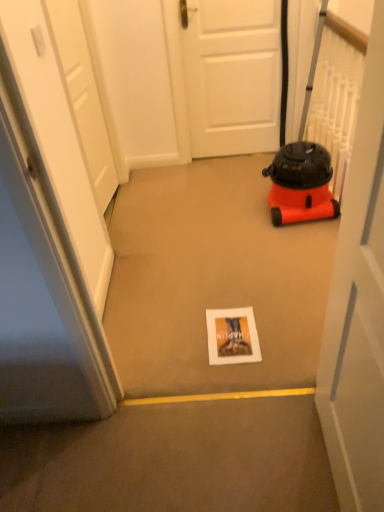
Measure the distance between point (210, 347) and camera.

The depth of point (210, 347) is 5.72 feet.

What do you see at coordinates (300, 156) in the screenshot? I see `orange matte vacuum cleaner at right` at bounding box center [300, 156].

What is the approximate width of white matte door at center, marked as the 3th door in a front-to-back arrangement?

It is 1.92 inches.

Measure the distance between white matte door at center, the third door viewed from the left, and camera.

white matte door at center, the third door viewed from the left, is 79.10 centimeters from camera.

Image resolution: width=384 pixels, height=512 pixels. What do you see at coordinates (358, 308) in the screenshot?
I see `white matte door at center, acting as the 1th door starting from the right` at bounding box center [358, 308].

Where is `matte paper postcard at center`? matte paper postcard at center is located at coordinates (232, 336).

Between point (312, 143) and point (240, 22), which one is positioned behind?

The point (312, 143) is farther from the camera.

Find the location of a particular element. The image size is (384, 512). door that appears above the orange matte vacuum cleaner at right (from the image's perspective) is located at coordinates (235, 74).

From a real-world perspective, relative to white matte door at center, the first door in the back-to-front sequence, is orange matte vacuum cleaner at right vertically above or below?

From a real-world perspective, orange matte vacuum cleaner at right is physically above white matte door at center, the first door in the back-to-front sequence.

From the picture: Measure the distance between white matte door at upper left, arranged as the 2th door when viewed from the front, and white matte door at center, marked as the 3th door in a front-to-back arrangement.

white matte door at upper left, arranged as the 2th door when viewed from the front, and white matte door at center, marked as the 3th door in a front-to-back arrangement, are 35.51 inches apart.

Is white matte door at upper left, the 1th door when ordered from left to right, to the right of white matte door at center, the second door from the right, from the viewer's perspective?

No, white matte door at upper left, the 1th door when ordered from left to right, is not to the right of white matte door at center, the second door from the right.

From a real-world perspective, who is located higher, white matte door at upper left, the third door positioned from the right, or white matte door at center, marked as the 3th door in a front-to-back arrangement?

In real-world perspective, white matte door at upper left, the third door positioned from the right, is above.

Could you tell me if white matte door at upper left, the 1th door when ordered from left to right, is turned towards white matte door at center, the second door from the right?

Yes, white matte door at upper left, the 1th door when ordered from left to right, is turned towards white matte door at center, the second door from the right.

Which is more to the left, white matte door at center, the first door viewed from the front, or matte paper postcard at center?

From the viewer's perspective, matte paper postcard at center appears more on the left side.

Which is farther, [379,502] or [223,339]?

Point [223,339]

From the image's perspective, is white matte door at center, the third door viewed from the left, on matte paper postcard at center?

Yes.

Considering the relative positions of white matte door at center, the third door viewed from the left, and matte paper postcard at center in the image provided, is white matte door at center, the third door viewed from the left, in front of matte paper postcard at center?

Yes, the depth of white matte door at center, the third door viewed from the left, is less than that of matte paper postcard at center.

Considering the positions of objects matte paper postcard at center and orange matte vacuum cleaner at right in the image provided, who is behind, matte paper postcard at center or orange matte vacuum cleaner at right?

Positioned behind is orange matte vacuum cleaner at right.

From the image's perspective, is matte paper postcard at center on top of orange matte vacuum cleaner at right?

Incorrect, from the image's perspective, matte paper postcard at center is lower than orange matte vacuum cleaner at right.

Which is further, [259,349] or [283,186]?

Positioned behind is point [283,186].

Visually, is matte paper postcard at center positioned to the left or to the right of orange matte vacuum cleaner at right?

In the image, matte paper postcard at center appears on the left side of orange matte vacuum cleaner at right.

Is the surface of orange matte vacuum cleaner at right in direct contact with matte paper postcard at center?

There is a gap between orange matte vacuum cleaner at right and matte paper postcard at center.

From a real-world perspective, is orange matte vacuum cleaner at right located higher than matte paper postcard at center?

Yes, from a real-world perspective, orange matte vacuum cleaner at right is above matte paper postcard at center.

From the image's perspective, is orange matte vacuum cleaner at right above or below matte paper postcard at center?

orange matte vacuum cleaner at right is situated higher than matte paper postcard at center in the image.

In the scene shown: Considering the sizes of orange matte vacuum cleaner at right and matte paper postcard at center in the image, is orange matte vacuum cleaner at right taller or shorter than matte paper postcard at center?

orange matte vacuum cleaner at right is taller than matte paper postcard at center.

Between white matte door at center, the second door from the right, and orange matte vacuum cleaner at right, which one has smaller size?

With smaller size is white matte door at center, the second door from the right.

Considering the sizes of objects white matte door at center, the second door from the right, and orange matte vacuum cleaner at right in the image provided, who is taller, white matte door at center, the second door from the right, or orange matte vacuum cleaner at right?

orange matte vacuum cleaner at right.

Is white matte door at center, marked as the 3th door in a front-to-back arrangement, surrounding orange matte vacuum cleaner at right?

That's incorrect, orange matte vacuum cleaner at right is not inside white matte door at center, marked as the 3th door in a front-to-back arrangement.

Looking at this image, from a real-world perspective, is white matte door at center, the first door in the back-to-front sequence, under orange matte vacuum cleaner at right?

Yes, from a real-world perspective, white matte door at center, the first door in the back-to-front sequence, is below orange matte vacuum cleaner at right.

Is white matte door at center, marked as the 3th door in a front-to-back arrangement, located within matte paper postcard at center?

No, white matte door at center, marked as the 3th door in a front-to-back arrangement, is not a part of matte paper postcard at center.

From the image's perspective, is matte paper postcard at center on white matte door at center, the first door in the back-to-front sequence?

No.

Is matte paper postcard at center taller than white matte door at center, the second door from the right?

No, matte paper postcard at center is not taller than white matte door at center, the second door from the right.

Could you tell me if matte paper postcard at center is facing white matte door at center, the second door from the right?

No, matte paper postcard at center is not facing towards white matte door at center, the second door from the right.

I want to click on the 2nd door counting from the left side of the orange matte vacuum cleaner at right, so click(x=235, y=74).

Identify the location of door that is the 1st object located in front of the white matte door at center, the second door from the right. (82, 94).

Looking at the image, which one is located further to orange matte vacuum cleaner at right, white matte door at upper left, the 1th door when ordered from left to right, or white matte door at center, acting as the 1th door starting from the right?

The object further to orange matte vacuum cleaner at right is white matte door at center, acting as the 1th door starting from the right.

Looking at the image, which one is located closer to orange matte vacuum cleaner at right, white matte door at center, the 2th door when ordered from left to right, or matte paper postcard at center?

Among the two, white matte door at center, the 2th door when ordered from left to right, is located nearer to orange matte vacuum cleaner at right.

Looking at the image, which one is located closer to white matte door at center, the first door viewed from the front, white matte door at upper left, marked as the 2th door in a back-to-front arrangement, or orange matte vacuum cleaner at right?

orange matte vacuum cleaner at right is positioned closer to the anchor white matte door at center, the first door viewed from the front.

Considering their positions, is white matte door at center, the second door from the right, positioned closer to white matte door at upper left, arranged as the 2th door when viewed from the front, than orange matte vacuum cleaner at right?

The object closer to white matte door at upper left, arranged as the 2th door when viewed from the front, is white matte door at center, the second door from the right.

In the scene shown: Which object lies further to the anchor point orange matte vacuum cleaner at right, white matte door at upper left, the 1th door when ordered from left to right, or white matte door at center, the second door from the right?

Based on the image, white matte door at upper left, the 1th door when ordered from left to right, appears to be further to orange matte vacuum cleaner at right.

From the image, which object appears to be nearer to white matte door at center, the third door viewed from the left, matte paper postcard at center or white matte door at center, the second door from the right?

The object closer to white matte door at center, the third door viewed from the left, is matte paper postcard at center.

Looking at the image, which one is located further to white matte door at center, the second door from the right, white matte door at center, the third door viewed from the left, or white matte door at upper left, the third door positioned from the right?

white matte door at center, the third door viewed from the left, lies further to white matte door at center, the second door from the right, than the other object.

When comparing their distances from white matte door at upper left, the 1th door when ordered from left to right, does white matte door at center, the 2th door when ordered from left to right, or white matte door at center, marked as the third door in a back-to-front arrangement, seem closer?

white matte door at center, the 2th door when ordered from left to right, is positioned closer to the anchor white matte door at upper left, the 1th door when ordered from left to right.

Find the location of `postcard between white matte door at center, acting as the 1th door starting from the right, and orange matte vacuum cleaner at right from front to back`. postcard between white matte door at center, acting as the 1th door starting from the right, and orange matte vacuum cleaner at right from front to back is located at coordinates (232, 336).

Identify the location of equipment between white matte door at center, the first door viewed from the front, and white matte door at center, the first door in the back-to-front sequence, from front to back. (300, 156).

At what (x,y) coordinates should I click in order to perform the action: click on door positioned between white matte door at center, the first door viewed from the front, and white matte door at center, the second door from the right, from near to far. Please return your answer as a coordinate pair (x, y). Looking at the image, I should click on (82, 94).

This screenshot has width=384, height=512. Find the location of `postcard located between white matte door at center, marked as the third door in a back-to-front arrangement, and white matte door at center, the second door from the right, in the depth direction`. postcard located between white matte door at center, marked as the third door in a back-to-front arrangement, and white matte door at center, the second door from the right, in the depth direction is located at coordinates (232, 336).